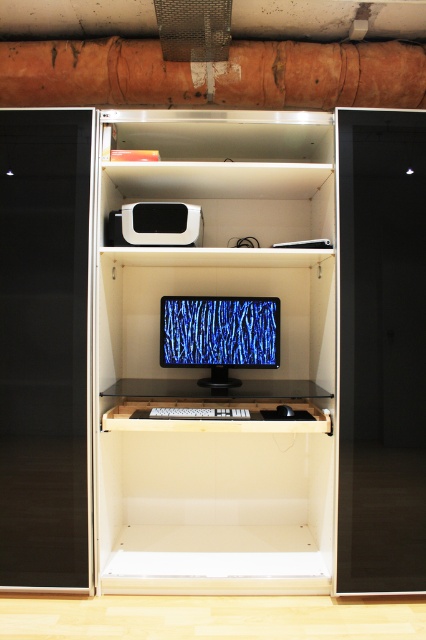
Does black glossy monitor at center have a smaller size compared to matte black monitor at center?

Incorrect, black glossy monitor at center is not smaller in size than matte black monitor at center.

Which is more to the left, black glossy monitor at center or matte black monitor at center?

From the viewer's perspective, black glossy monitor at center appears more on the left side.

Image resolution: width=426 pixels, height=640 pixels. Identify the location of black glossy monitor at center. (209, 371).